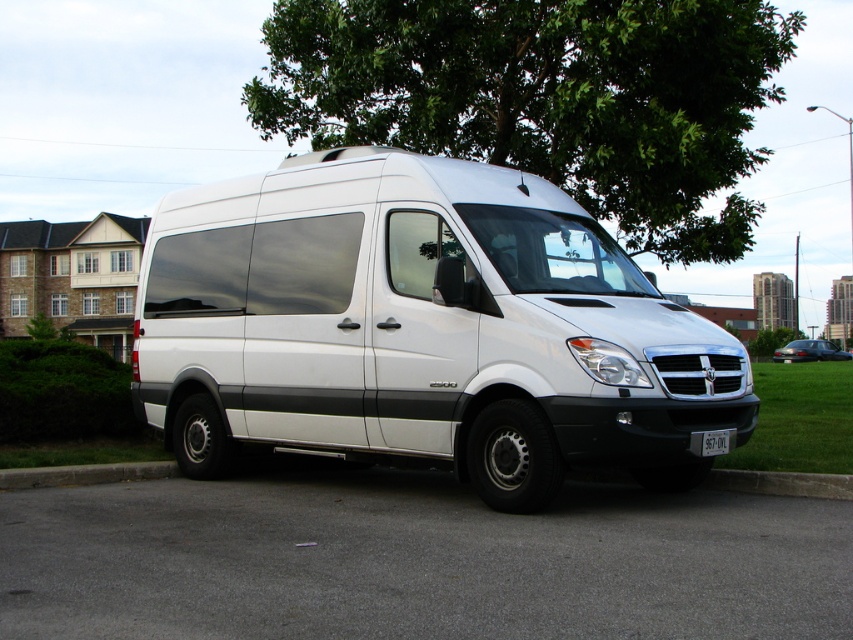
You are a delivery driver who needs to park your van so that the white plastic license plate at center is visible from the street. The gray concrete curb at lower right is in the way. Can you move the curb to the side so that the license plate is visible?

The gray concrete curb at lower right might be wider than white plastic license plate at center, so it is uncertain if moving the curb would allow the license plate to be visible. Check the width difference before attempting.

Consider the image. You are a delivery driver who needs to back up the white Dodge Sprinter van into an open space behind it. The open space is 60 feet long. Based on the distance between the green leafy tree at upper center and the concrete at lower center, will the van fit entirely within the open space when backing up?

The distance between the green leafy tree at upper center and the concrete at lower center is 57.40 feet. Since the open space is 60 feet long, the van will fit entirely within the open space when backing up as 57.40 feet is less than 60 feet.